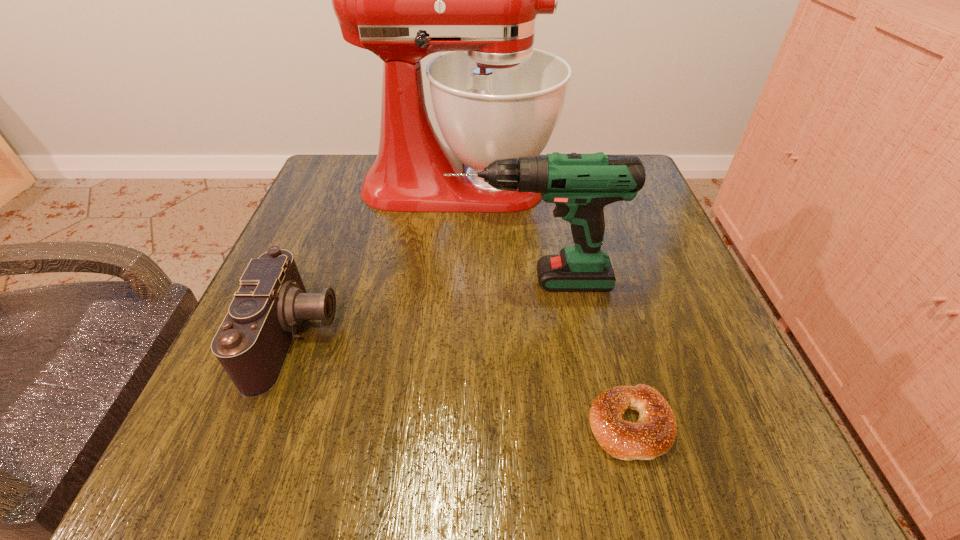
The image size is (960, 540). I want to click on the tallest object, so click(x=494, y=96).

Image resolution: width=960 pixels, height=540 pixels. Find the location of `mixer`. mixer is located at coordinates (494, 96).

Locate an element on the screen. This screenshot has width=960, height=540. the second tallest object is located at coordinates (581, 185).

At what (x,y) coordinates should I click in order to perform the action: click on the third tallest object. Please return your answer as a coordinate pair (x, y). The height and width of the screenshot is (540, 960). Looking at the image, I should click on [252, 343].

Identify the location of bagel. (653, 435).

This screenshot has height=540, width=960. Identify the location of vacant space located at the attachment hub of the tallest object. (644, 185).

Find the location of a particular element. free space located on the handle side of the drill is located at coordinates (391, 281).

Image resolution: width=960 pixels, height=540 pixels. Find the location of `vacant space located on the handle side of the drill`. vacant space located on the handle side of the drill is located at coordinates (281, 281).

What are the coordinates of `free space located 0.240m on the handle side of the drill` in the screenshot? It's located at (320, 281).

Where is `free region located 0.390m on the front-facing side of the second shortest object`? The image size is (960, 540). free region located 0.390m on the front-facing side of the second shortest object is located at coordinates (575, 337).